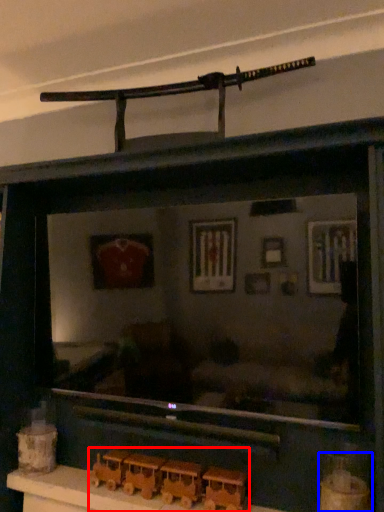
Question: Among these objects, which one is farthest to the camera, toy (highlighted by a red box) or toy (highlighted by a blue box)?

Choices:
 (A) toy
 (B) toy

Answer: (A)